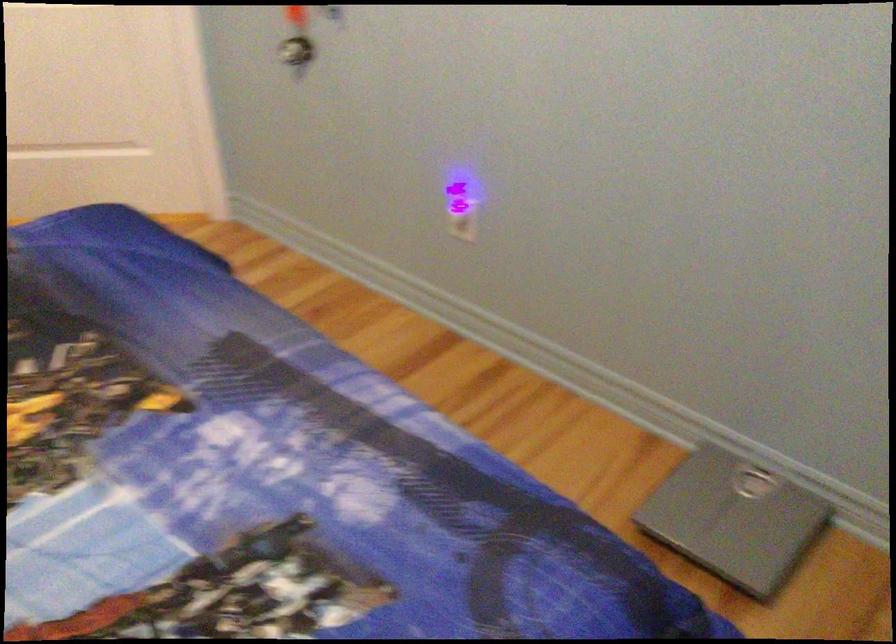
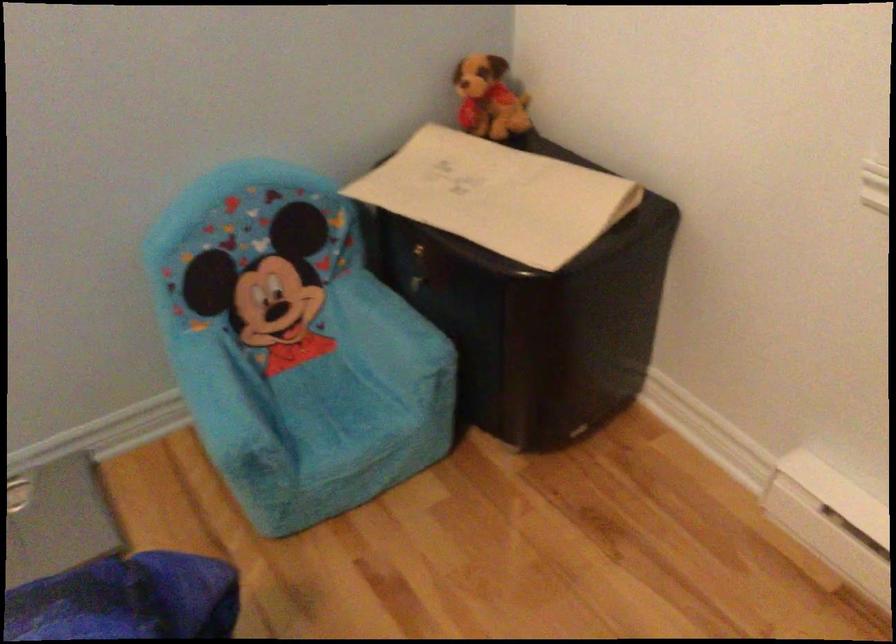
First-person continuous shooting, in which direction is the camera rotating?

The camera rotated toward right-down.